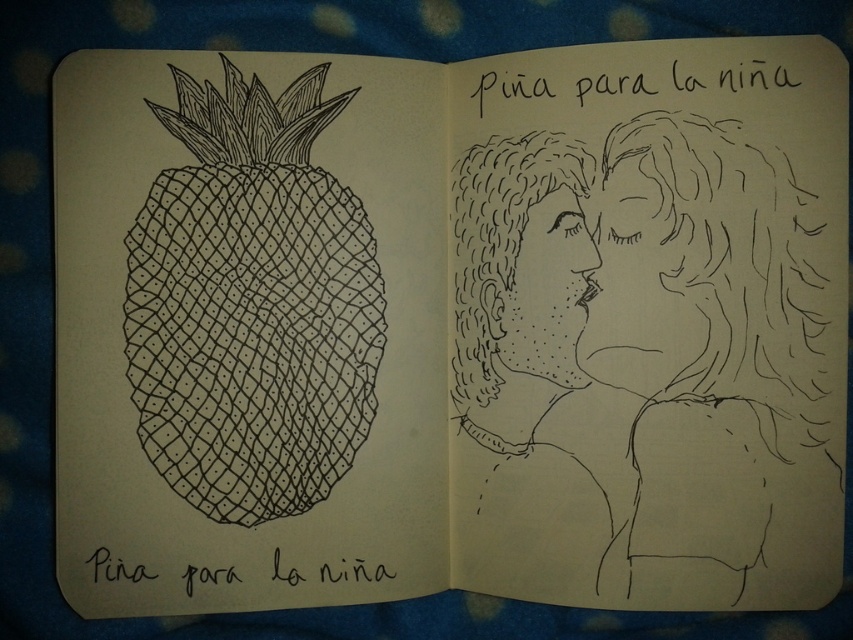
Question: Is black ink couple at center wider than black ink pineapple at left?

Choices:
 (A) yes
 (B) no

Answer: (A)

Question: Which object appears closest to the camera in this image?

Choices:
 (A) black ink couple at center
 (B) black ink pineapple at left

Answer: (A)

Question: Is black ink couple at center above black ink pineapple at left?

Choices:
 (A) yes
 (B) no

Answer: (B)

Question: Does black ink couple at center have a larger size compared to black ink pineapple at left?

Choices:
 (A) no
 (B) yes

Answer: (B)

Question: Which point appears farthest from the camera in this image?

Choices:
 (A) (776, 321)
 (B) (349, 396)

Answer: (B)